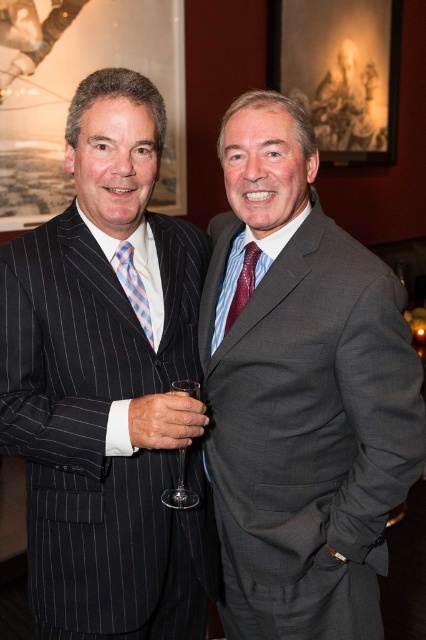
You are a photographer at a social event. You need to capture a closeup shot of the light blue striped tie at center and the clear glass wine glass at center. Which object should you focus on first if you want to ensure both are in frame without moving the camera?

The light blue striped tie at center should be focused on first because it occupies less space than the clear glass wine glass at center, so it can be framed more easily while still including the larger glass in the shot.

You are at a social event and want to know the spatial relationship between two points marked in the image. Which point is closer to you, point (34, 252) or point (135, 305)?

Point (34, 252) is in front of point (135, 305), so it is closer to you.

You are a photographer at the event and need to capture a closeup shot of both the light blue striped tie at center and the clear glass wine glass at center. Given that your camera has a minimum focus distance of 10 inches, will you be able to focus on both objects simultaneously?

The light blue striped tie at center and the clear glass wine glass at center are 10.22 inches apart from each other. Since the minimum focus distance is 10 inches, the photographer can focus on both objects as the distance between them is just over the required minimum.